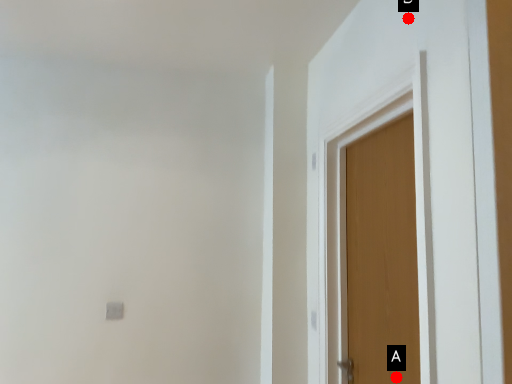
Question: Two points are circled on the image, labeled by A and B beside each circle. Among these points, which one is farthest from the camera?

Choices:
 (A) A is further
 (B) B is further

Answer: (A)